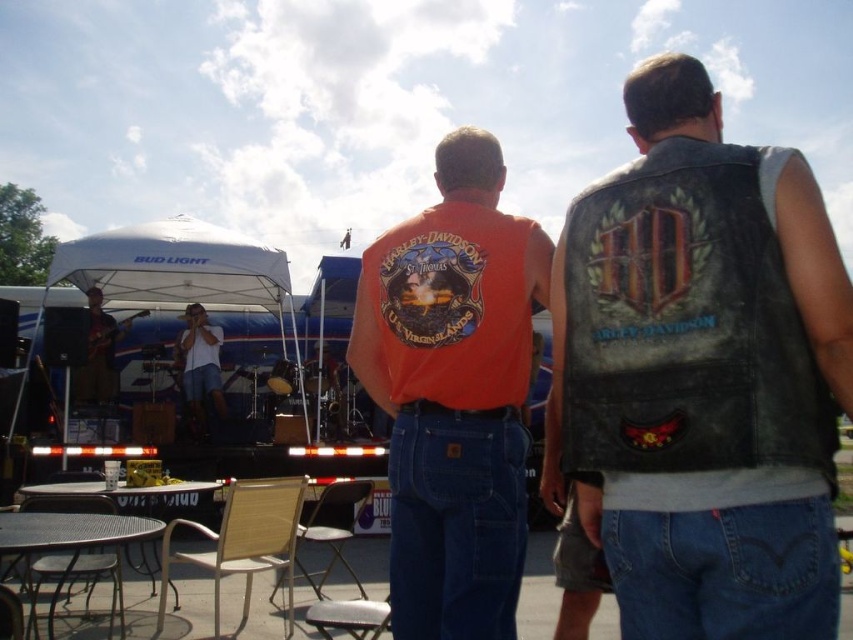
You are standing at the center of the image and want to locate the leather vest at center. According to the coordinates provided, in which direction should you look to find it?

The leather vest at center is located at coordinates point (701, 374), so you should look slightly to the right and upwards from the center to locate it.